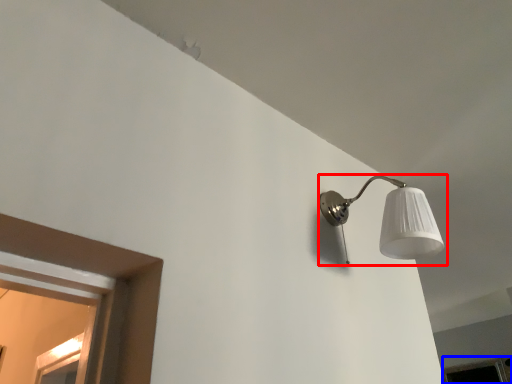
Question: Which point is further to the camera, lamp (highlighted by a red box) or window (highlighted by a blue box)?

Choices:
 (A) lamp
 (B) window

Answer: (B)